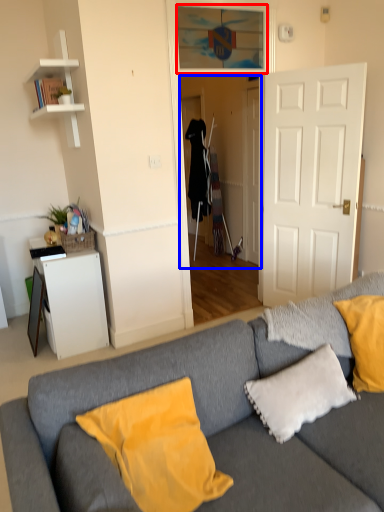
Question: Which point is closer to the camera, window (highlighted by a red box) or glass door (highlighted by a blue box)?

Choices:
 (A) window
 (B) glass door

Answer: (A)